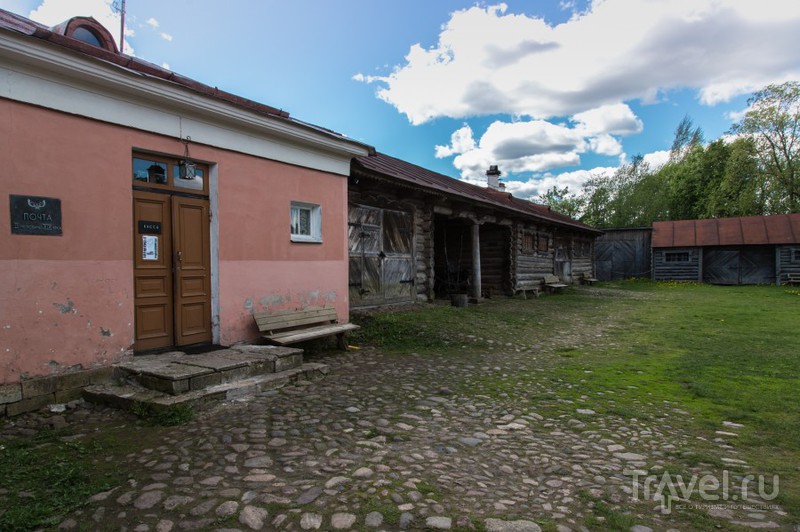
This screenshot has height=532, width=800. Find the location of `window`. window is located at coordinates (86, 30).